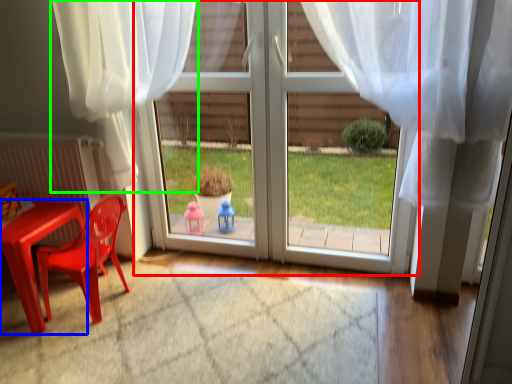
Question: Estimate the real-world distances between objects in this image. Which object is closer to door (highlighted by a red box), table (highlighted by a blue box) or curtain (highlighted by a green box)?

Choices:
 (A) table
 (B) curtain

Answer: (B)